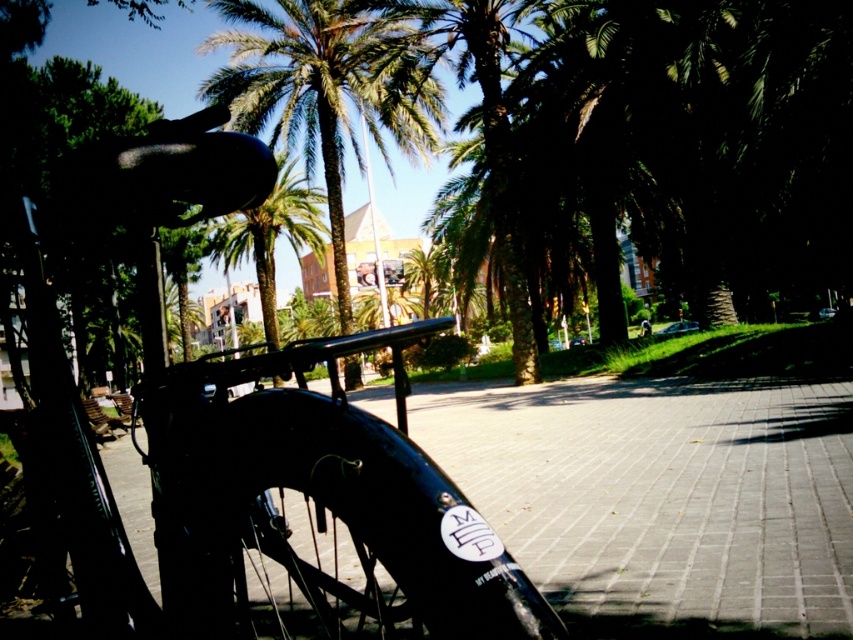
You are a park visitor who wants to plant a new tree in the park. The new tree requires a minimum of 10 meters of space between it and the nearest existing tree to thrive. Based on the scene, can you plant the new tree between the green leafy tree at center and the green leafy palm tree at upper center?

The green leafy tree at center is 10.19 meters from the green leafy palm tree at upper center. Since the required minimum distance is 10 meters, planting the new tree between them would meet the requirement as the existing spacing already exceeds the needed 10 meters.

You are a pedestrian trying to cross the park pathway. You see the shiny black bicycle at center and the green leafy tree at center. Which object is closer to you?

The shiny black bicycle at center is closer to you because it is in front of the green leafy tree at center.